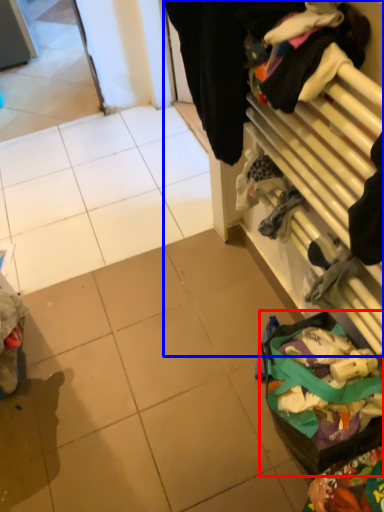
Question: Which object appears closest to the camera in this image, waste (highlighted by a red box) or closet (highlighted by a blue box)?

Choices:
 (A) waste
 (B) closet

Answer: (B)